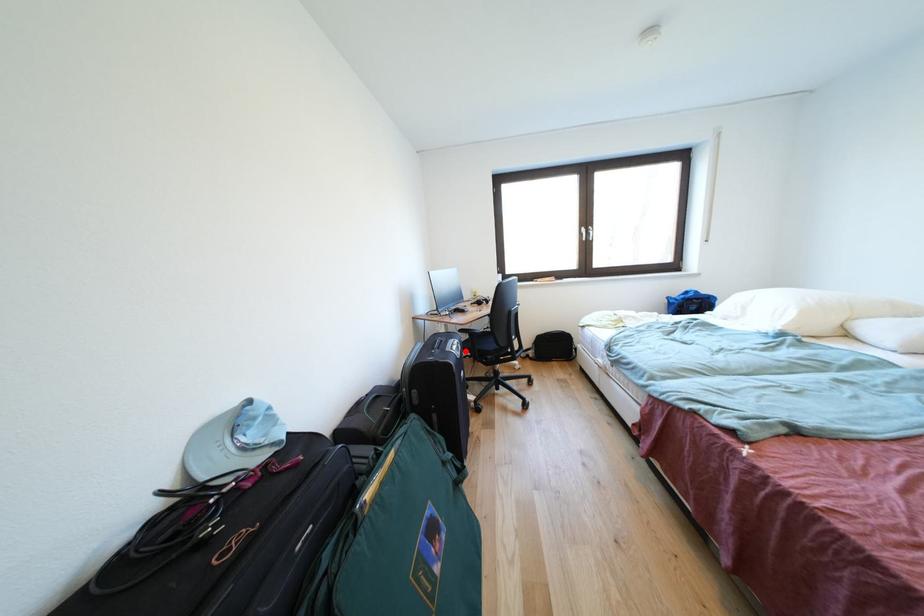
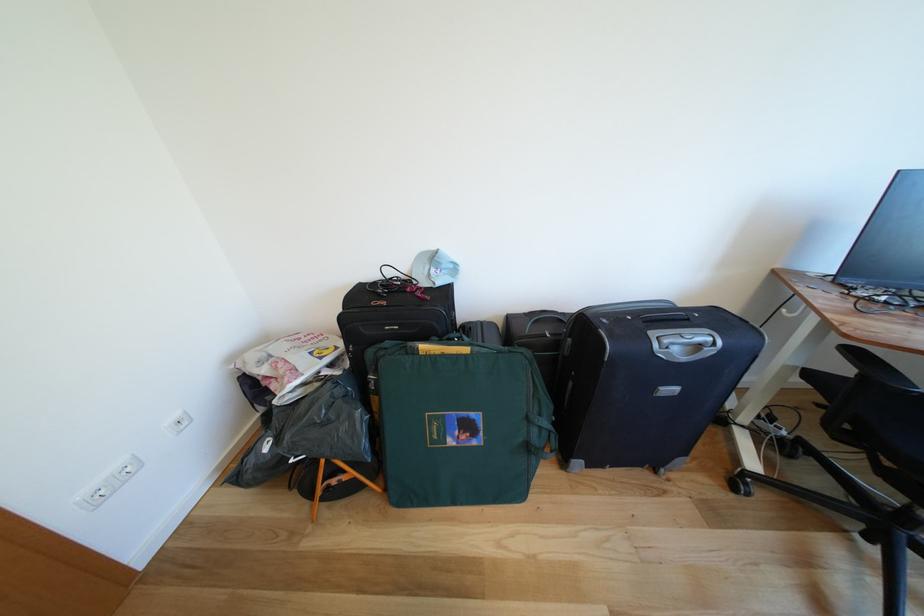
In the second image, find the point that corresponds to the highlighted location in the first image.

(707, 351)